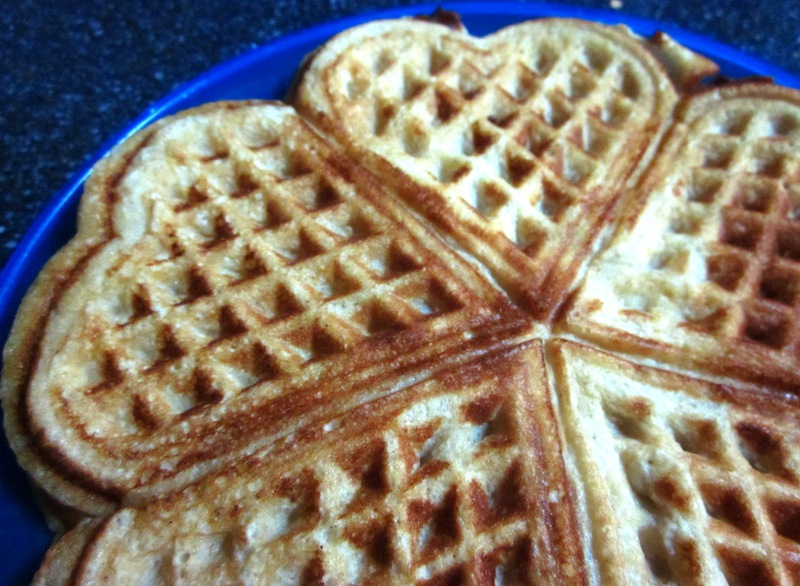
This screenshot has width=800, height=586. In order to click on plate in this screenshot , I will do `click(244, 76)`.